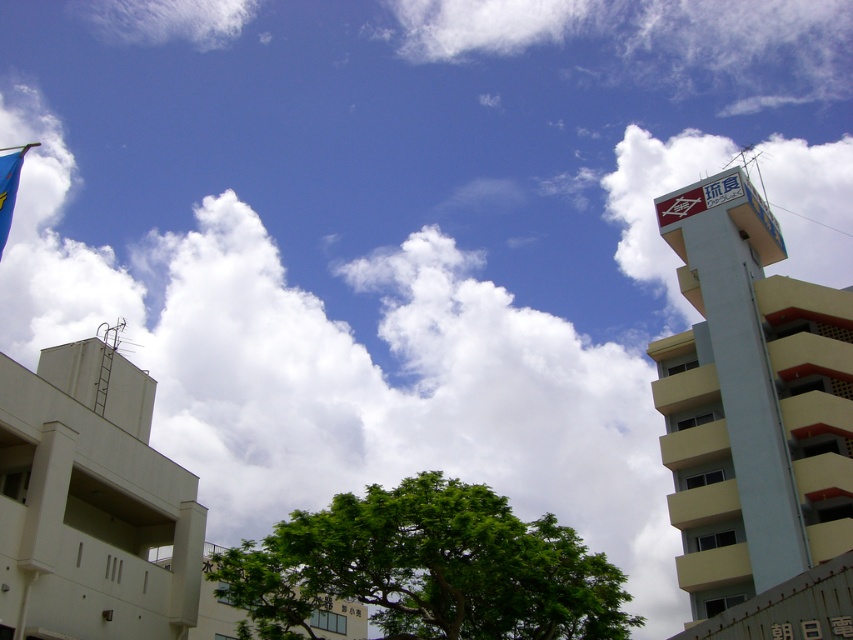
Is yellow matte tower at upper right above blue fabric flag at upper left?

Incorrect, yellow matte tower at upper right is not positioned above blue fabric flag at upper left.

How much distance is there between yellow matte tower at upper right and blue fabric flag at upper left?

yellow matte tower at upper right is 176.83 feet away from blue fabric flag at upper left.

Who is more forward, (831,499) or (0,179)?

Point (0,179)

What are the coordinates of `yellow matte tower at upper right` in the screenshot? It's located at (751, 401).